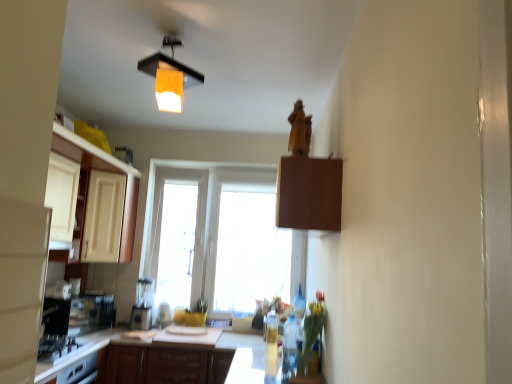
Where is `translucent plastic bottle at center, acting as the 2th bottle starting from the front`? translucent plastic bottle at center, acting as the 2th bottle starting from the front is located at coordinates click(x=271, y=344).

Identify the location of translucent plastic bottle at lower center, the first bottle from the front. The height and width of the screenshot is (384, 512). (289, 348).

From a real-world perspective, which object stands above the other?

matte white blender at center.

At what (x,y) coordinates should I click in order to perform the action: click on appliance above the translucent plastic bottle at center, the first bottle positioned from the back (from a real-world perspective). Please return your answer as a coordinate pair (x, y). Looking at the image, I should click on (143, 305).

Is matte white blender at center facing away from translucent plastic bottle at center, acting as the 2th bottle starting from the front?

No.

Can you confirm if matte white blender at center is shorter than translucent plastic bottle at lower center, the second bottle in the back-to-front sequence?

Incorrect, the height of matte white blender at center does not fall short of that of translucent plastic bottle at lower center, the second bottle in the back-to-front sequence.

From the image's perspective, is matte white blender at center located above or below translucent plastic bottle at lower center, the second bottle in the back-to-front sequence?

Based on their image positions, matte white blender at center is located beneath translucent plastic bottle at lower center, the second bottle in the back-to-front sequence.

Does matte white blender at center have a lesser width compared to translucent plastic bottle at lower center, the first bottle from the front?

No.

From the image's perspective, relative to brown matte cabinet at upper center, the first cabinetry positioned from the top, is translucent plastic bottle at center, the first bottle positioned from the back, above or below?

translucent plastic bottle at center, the first bottle positioned from the back, is below brown matte cabinet at upper center, the first cabinetry positioned from the top.

Which is in front, point (267, 321) or point (317, 163)?

The point (317, 163) is more forward.

How many degrees apart are the facing directions of translucent plastic bottle at center, the first bottle positioned from the back, and brown matte cabinet at upper center, which appears as the first cabinetry when viewed from the right?

0.000135 degrees.

Is translucent plastic bottle at center, the first bottle positioned from the back, situated inside brown matte cabinet at upper center, the 3th cabinetry viewed from the back, or outside?

translucent plastic bottle at center, the first bottle positioned from the back, exists outside the volume of brown matte cabinet at upper center, the 3th cabinetry viewed from the back.

Between wooden cabinet at center, the 2th cabinetry positioned from the left, and wooden panel at upper center, which one appears on the right side from the viewer's perspective?

wooden panel at upper center is more to the right.

Is wooden cabinet at center, marked as the 2th cabinetry in a right-to-left arrangement, looking in the opposite direction of wooden panel at upper center?

No, wooden panel at upper center is not at the back of wooden cabinet at center, marked as the 2th cabinetry in a right-to-left arrangement.

Is wooden cabinet at center, which ranks as the 2th cabinetry in back-to-front order, not inside wooden panel at upper center?

Yes, wooden cabinet at center, which ranks as the 2th cabinetry in back-to-front order, is located beyond the bounds of wooden panel at upper center.

You are a GUI agent. You are given a task and a screenshot of the screen. Output one action in this format:
    pyautogui.click(x=<x>, y=<y>)
    Task: Click on the appliance above the translucent plastic bottle at center, the first bottle positioned from the back (from a real-world perspective)
    Image resolution: width=512 pixels, height=384 pixels.
    Given the screenshot: What is the action you would take?
    pyautogui.click(x=143, y=305)

Does translucent plastic bottle at center, the first bottle positioned from the back, have a smaller size compared to matte white blender at center?

Indeed, translucent plastic bottle at center, the first bottle positioned from the back, has a smaller size compared to matte white blender at center.

Considering the points (135, 359) and (308, 349), which point is behind, point (135, 359) or point (308, 349)?

The point (135, 359) is farther.

Is translucent glass vase at lower center at the back of wooden cabinet at center, which appears as the 2th cabinetry when viewed from the front?

That's not correct — wooden cabinet at center, which appears as the 2th cabinetry when viewed from the front, is not looking away from translucent glass vase at lower center.

Can you confirm if wooden cabinet at center, which ranks as the 2th cabinetry in back-to-front order, is shorter than translucent glass vase at lower center?

No, wooden cabinet at center, which ranks as the 2th cabinetry in back-to-front order, is not shorter than translucent glass vase at lower center.

Is translucent glass vase at lower center surrounded by wooden cabinet at center, the 2th cabinetry positioned from the left?

Definitely not — translucent glass vase at lower center is not inside wooden cabinet at center, the 2th cabinetry positioned from the left.

Is matte white blender at center oriented towards translucent glass vase at lower center?

No.

From a real-world perspective, is matte white blender at center physically located above or below translucent glass vase at lower center?

Clearly, from a real-world perspective, matte white blender at center is below translucent glass vase at lower center.

Is matte white blender at center not close to translucent glass vase at lower center?

matte white blender at center is positioned a significant distance from translucent glass vase at lower center.

Based on their positions, is matte white blender at center located to the left or right of translucent glass vase at lower center?

In the image, matte white blender at center appears on the left side of translucent glass vase at lower center.

The height and width of the screenshot is (384, 512). Find the location of `appliance that appears above the translucent plastic bottle at center, the first bottle positioned from the back (from a real-world perspective)`. appliance that appears above the translucent plastic bottle at center, the first bottle positioned from the back (from a real-world perspective) is located at coordinates (143, 305).

Where is `appliance behind the translucent plastic bottle at lower center, the second bottle in the back-to-front sequence`? The image size is (512, 384). appliance behind the translucent plastic bottle at lower center, the second bottle in the back-to-front sequence is located at coordinates (143, 305).

From the image, which object appears to be nearer to translucent plastic bottle at center, the first bottle positioned from the back, wooden cabinet at center, marked as the first cabinetry in a bottom-to-top arrangement, or matte white cabinet at left, which is the 3th cabinetry in front-to-back order?

wooden cabinet at center, marked as the first cabinetry in a bottom-to-top arrangement, is positioned closer to the anchor translucent plastic bottle at center, the first bottle positioned from the back.

Based on their spatial positions, is matte white cabinet at left, which appears as the third cabinetry when viewed from the right, or wooden panel at upper center further from translucent glass vase at lower center?

Among the two, matte white cabinet at left, which appears as the third cabinetry when viewed from the right, is located further to translucent glass vase at lower center.

Based on their spatial positions, is translucent plastic bottle at center, the first bottle positioned from the back, or translucent glass vase at lower center further from matte white blender at center?

translucent glass vase at lower center.

Considering their positions, is matte white blender at center positioned closer to wooden panel at upper center than matte white cabinet at left, the second cabinetry from the top?

The object closer to wooden panel at upper center is matte white cabinet at left, the second cabinetry from the top.

Looking at the image, which one is located further to brown matte cabinet at upper center, which appears as the first cabinetry when viewed from the right, translucent glass vase at lower center or wooden panel at upper center?

wooden panel at upper center lies further to brown matte cabinet at upper center, which appears as the first cabinetry when viewed from the right, than the other object.

Looking at the image, which one is located closer to translucent plastic bottle at lower center, the second bottle in the back-to-front sequence, wooden cabinet at center, marked as the first cabinetry in a bottom-to-top arrangement, or translucent glass vase at lower center?

translucent glass vase at lower center lies closer to translucent plastic bottle at lower center, the second bottle in the back-to-front sequence, than the other object.

Which object lies nearer to the anchor point matte white cabinet at left, which appears as the third cabinetry when viewed from the right, matte white blender at center or brown matte cabinet at upper center, the 3th cabinetry viewed from the back?

The object closer to matte white cabinet at left, which appears as the third cabinetry when viewed from the right, is matte white blender at center.

Considering their positions, is translucent plastic bottle at lower center, the first bottle from the front, positioned further to wooden cabinet at center, which appears as the 2th cabinetry when viewed from the front, than wooden panel at upper center?

The object further to wooden cabinet at center, which appears as the 2th cabinetry when viewed from the front, is wooden panel at upper center.

The height and width of the screenshot is (384, 512). I want to click on flower between wooden panel at upper center and translucent plastic bottle at center, acting as the 2th bottle starting from the front, in the vertical direction, so click(312, 336).

Locate an element on the screen. Image resolution: width=512 pixels, height=384 pixels. appliance between wooden panel at upper center and wooden cabinet at center, marked as the 2th cabinetry in a right-to-left arrangement, from top to bottom is located at coordinates (143, 305).

You are a GUI agent. You are given a task and a screenshot of the screen. Output one action in this format:
    pyautogui.click(x=<x>, y=<y>)
    Task: Click on the bottle between wooden panel at upper center and translucent plastic bottle at center, the first bottle positioned from the back, in the vertical direction
    The image size is (512, 384).
    Given the screenshot: What is the action you would take?
    pyautogui.click(x=289, y=348)

Locate an element on the screen. lamp between matte white cabinet at left, the second cabinetry from the top, and translucent plastic bottle at lower center, the second bottle in the back-to-front sequence is located at coordinates (170, 76).